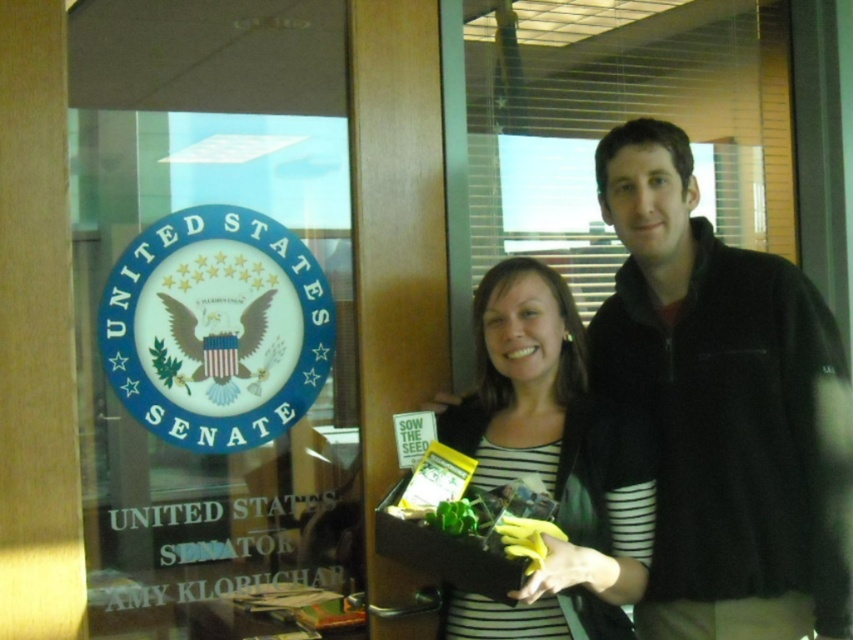
Describe the element at coordinates (186, 205) in the screenshot. I see `transparent glass at upper left` at that location.

Can you confirm if transparent glass at upper left is taller than black fleece jacket at center?

Indeed, transparent glass at upper left has a greater height compared to black fleece jacket at center.

Locate an element on the screen. Image resolution: width=853 pixels, height=640 pixels. transparent glass at upper left is located at coordinates (186, 205).

Can you confirm if transparent glass at upper left is shorter than striped fabric at center?

In fact, transparent glass at upper left may be taller than striped fabric at center.

Who is higher up, transparent glass at upper left or striped fabric at center?

transparent glass at upper left

Does point (332, 170) lie behind point (639, 547)?

That is True.

This screenshot has width=853, height=640. I want to click on transparent glass at upper left, so click(186, 205).

Who is taller, black fleece jacket at center or striped fabric at center?

Standing taller between the two is black fleece jacket at center.

Is black fleece jacket at center positioned behind striped fabric at center?

That is True.

Is point (672, 451) behind point (529, 600)?

That is True.

Where is `black fleece jacket at center`? black fleece jacket at center is located at coordinates (724, 408).